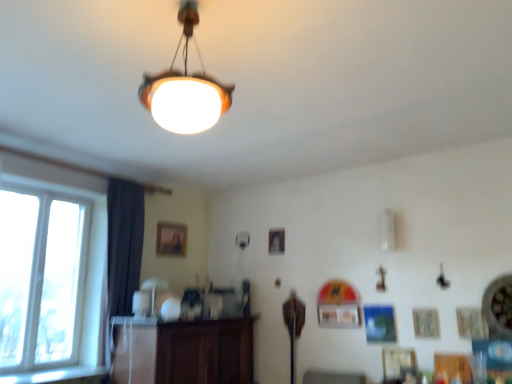
Question: Considering the positions of matte white lampshade at center, the first lamp from the bottom, and white glass window at left in the image, is matte white lampshade at center, the first lamp from the bottom, wider or thinner than white glass window at left?

Choices:
 (A) wide
 (B) thin

Answer: (A)

Question: In the image, is matte white lampshade at center, the first lamp viewed from the back, positioned in front of or behind white glass window at left?

Choices:
 (A) behind
 (B) front

Answer: (A)

Question: Which is farther from the brown wooden dresser at center?

Choices:
 (A) wooden frame at center
 (B) white glass window at left
 (C) dark fabric curtain at left
 (D) matte white lampshade at center, the first lamp viewed from the back
 (E) matte glass lampshade at upper center, the second lamp in the back-to-front sequence

Answer: (E)

Question: Estimate the real-world distances between objects in this image. Which object is closer to the brown wooden dresser at center?

Choices:
 (A) matte glass lampshade at upper center, the second lamp in the back-to-front sequence
 (B) wooden frame at center
 (C) matte white lampshade at center, the first lamp from the bottom
 (D) dark fabric curtain at left
 (E) white glass window at left

Answer: (C)